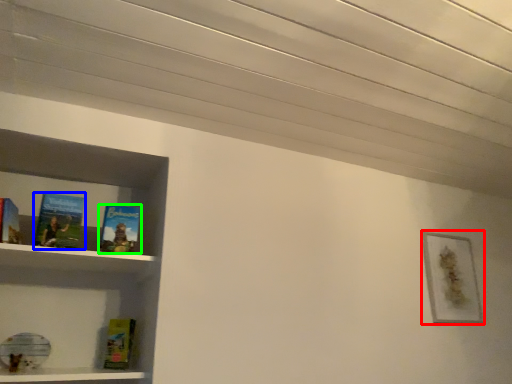
Question: Which object is the farthest from picture frame (highlighted by a red box)? Choose among these: book (highlighted by a blue box) or book (highlighted by a green box).

Choices:
 (A) book
 (B) book

Answer: (A)